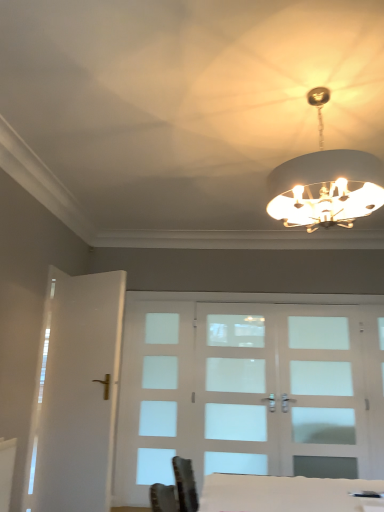
Question: From the image's perspective, relative to white glossy door at left, the 3th screen door viewed from the right, is white glossy table at lower center above or below?

Choices:
 (A) below
 (B) above

Answer: (A)

Question: Is point (369, 481) positioned closer to the camera than point (56, 298)?

Choices:
 (A) farther
 (B) closer

Answer: (B)

Question: Which of these objects is positioned farthest from the white glossy door at left, arranged as the first screen door when viewed from the left?

Choices:
 (A) white glass chandelier at upper center
 (B) white frosted glass door at center, which is the first screen door from right to left
 (C) clear glass door at center, which is the second screen door from left to right
 (D) white glossy table at lower center

Answer: (B)

Question: Which of these objects is positioned closest to the white glossy table at lower center?

Choices:
 (A) white glossy door at left, arranged as the first screen door when viewed from the left
 (B) white frosted glass door at center, the 3th screen door when ordered from left to right
 (C) white glass chandelier at upper center
 (D) clear glass door at center, which is the second screen door from right to left

Answer: (C)